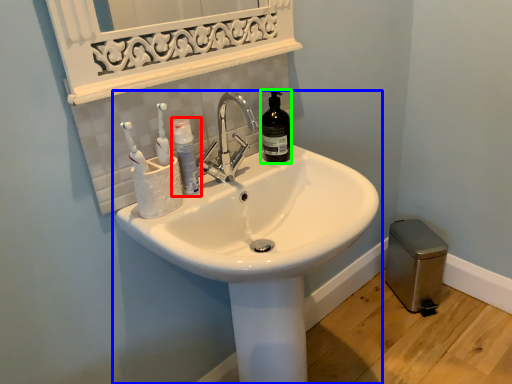
Question: Based on their relative distances, which object is nearer to mouthwash (highlighted by a red box)? Choose from sink (highlighted by a blue box) and bottle (highlighted by a green box).

Choices:
 (A) sink
 (B) bottle

Answer: (B)